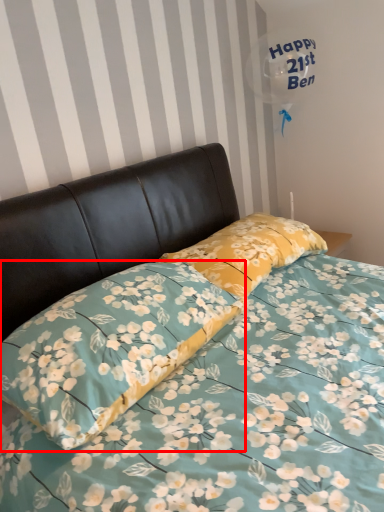
Question: Observing the image, what is the correct spatial positioning of pillow (annotated by the red box) in reference to pillow?

Choices:
 (A) left
 (B) right

Answer: (A)